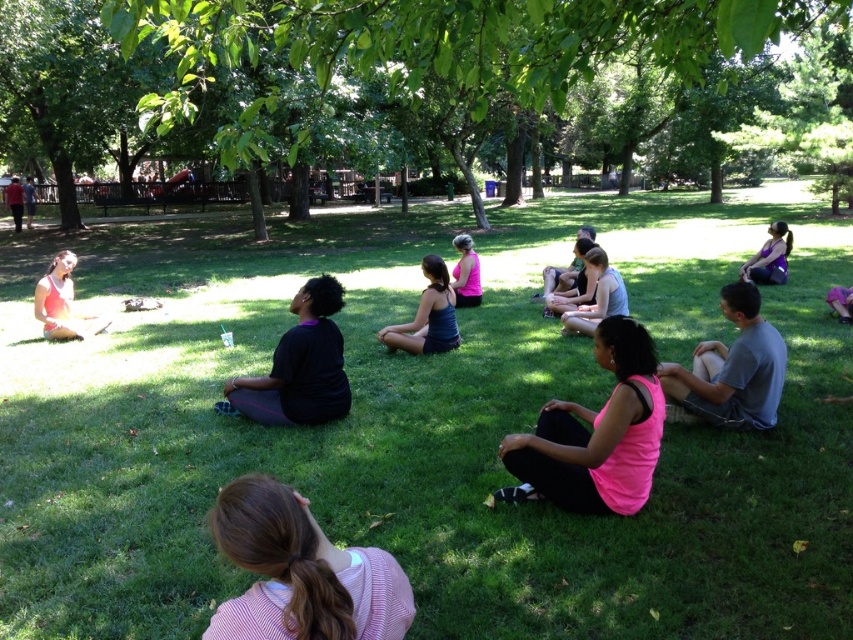
Question: Is matte black tank top at center below matte pink tank top at lower left?

Choices:
 (A) yes
 (B) no

Answer: (A)

Question: Which of the following is the farthest from the observer?

Choices:
 (A) green leafy tree at upper center
 (B) matte black tank top at center

Answer: (B)

Question: Among these objects, which one is nearest to the camera?

Choices:
 (A) green leafy tree at upper center
 (B) purple matte tank top at upper right
 (C) gray cotton shirt at lower right
 (D) green grass at center

Answer: (A)

Question: Which object is closer to the camera taking this photo?

Choices:
 (A) green leafy tree at upper center
 (B) green grass at center
 (C) purple matte tank top at upper right

Answer: (A)

Question: Does pink matte tank top at center have a greater width compared to gray cotton shirt at lower right?

Choices:
 (A) yes
 (B) no

Answer: (B)

Question: Is pink fabric ponytail at lower center positioned before pink fabric tank top at center?

Choices:
 (A) yes
 (B) no

Answer: (A)